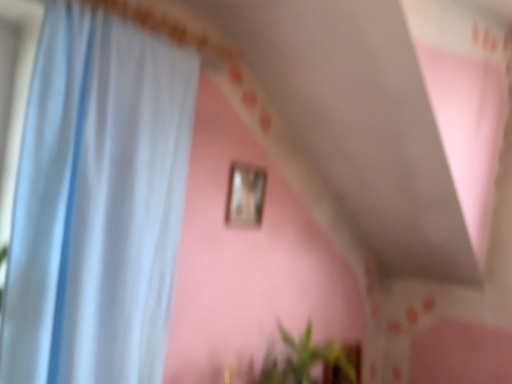
Question: Is white sheer curtain at left next to green leafy plant at lower center?

Choices:
 (A) no
 (B) yes

Answer: (A)

Question: Is white sheer curtain at left completely or partially outside of green leafy plant at lower center?

Choices:
 (A) no
 (B) yes

Answer: (B)

Question: Can you confirm if white sheer curtain at left is wider than green leafy plant at lower center?

Choices:
 (A) no
 (B) yes

Answer: (A)

Question: Does white sheer curtain at left have a lesser width compared to green leafy plant at lower center?

Choices:
 (A) no
 (B) yes

Answer: (B)

Question: Is white sheer curtain at left further to the viewer compared to green leafy plant at lower center?

Choices:
 (A) no
 (B) yes

Answer: (A)

Question: Can you confirm if white sheer curtain at left is smaller than green leafy plant at lower center?

Choices:
 (A) yes
 (B) no

Answer: (B)

Question: Does white sheer curtain at left have a lesser width compared to wooden picture frame at upper center?

Choices:
 (A) yes
 (B) no

Answer: (B)

Question: Is white sheer curtain at left bigger than wooden picture frame at upper center?

Choices:
 (A) no
 (B) yes

Answer: (B)

Question: From a real-world perspective, is white sheer curtain at left located beneath wooden picture frame at upper center?

Choices:
 (A) yes
 (B) no

Answer: (A)

Question: Is wooden picture frame at upper center at the back of white sheer curtain at left?

Choices:
 (A) yes
 (B) no

Answer: (B)

Question: Is white sheer curtain at left touching wooden picture frame at upper center?

Choices:
 (A) no
 (B) yes

Answer: (A)

Question: Is white sheer curtain at left to the right of wooden picture frame at upper center from the viewer's perspective?

Choices:
 (A) yes
 (B) no

Answer: (B)

Question: Considering the relative sizes of wooden picture frame at upper center and white sheer curtain at left in the image provided, is wooden picture frame at upper center smaller than white sheer curtain at left?

Choices:
 (A) yes
 (B) no

Answer: (A)